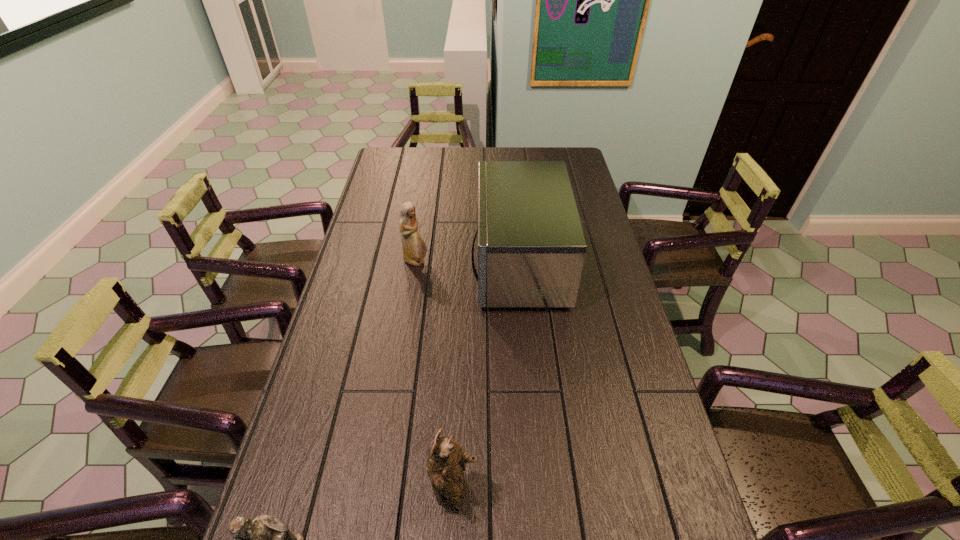
Where is `the closest object to the second nearest figurine`? This screenshot has width=960, height=540. the closest object to the second nearest figurine is located at coordinates (266, 539).

The height and width of the screenshot is (540, 960). Identify the location of the second closest figurine relative to the third object from right to left. (266, 539).

Locate an element on the screen. This screenshot has height=540, width=960. the closest figurine to the nearest figurine is located at coordinates (446, 462).